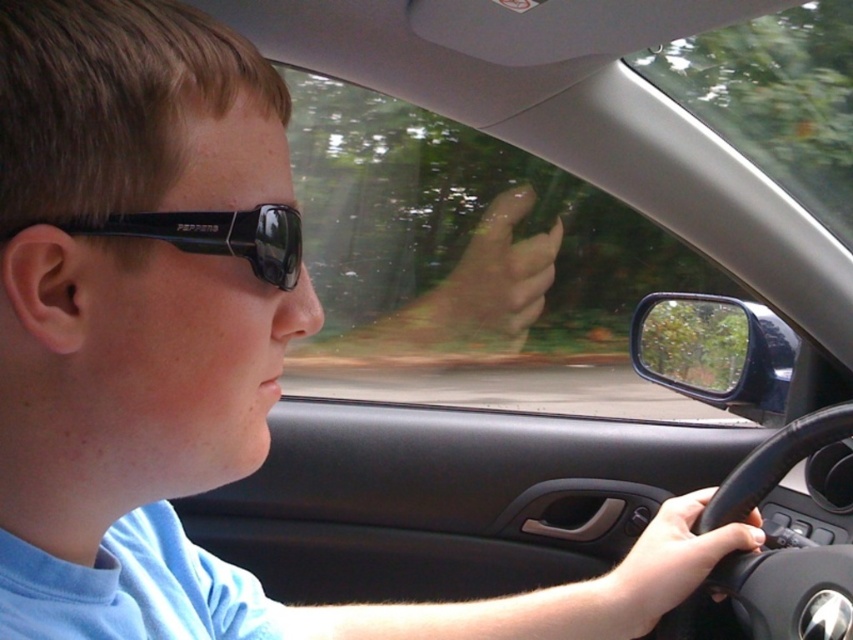
You are a passenger in the car and want to place a small object on the dashboard. The dashboard is located at the front of the car. Where should you place the object so that it is directly in front of the black matte sunglasses at upper left?

Place the object at the position corresponding to the coordinates of the black matte sunglasses at upper left, which is at point (218, 236), to ensure it is directly in front.